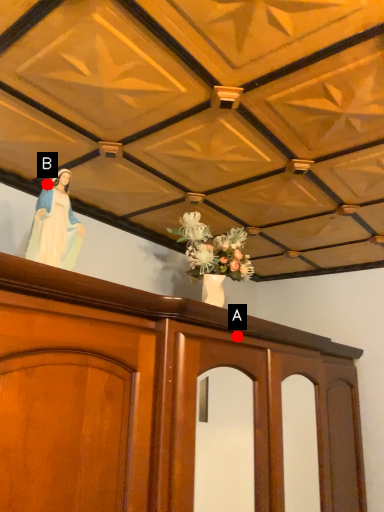
Question: Two points are circled on the image, labeled by A and B beside each circle. Which of the following is the farthest from the observer?

Choices:
 (A) A is further
 (B) B is further

Answer: (A)